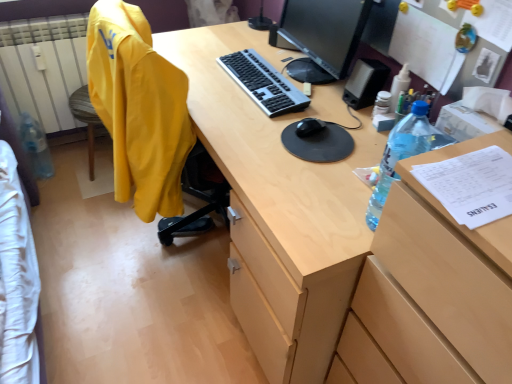
In the scene shown: Measure the distance between point (x=301, y=25) and camera.

The depth of point (x=301, y=25) is 1.62 meters.

Locate an element on the screen. black glossy monitor at upper center is located at coordinates (325, 30).

Identify the location of black matte mouse at center. (309, 127).

What do you see at coordinates (431, 291) in the screenshot? This screenshot has width=512, height=384. I see `wooden file cabinet at right` at bounding box center [431, 291].

The image size is (512, 384). What do you see at coordinates (139, 108) in the screenshot?
I see `yellow fabric jacket at left, the 1th clothing from the right` at bounding box center [139, 108].

This screenshot has height=384, width=512. I want to click on silver/black plastic keyboard at center, so click(263, 83).

Is yellow fabric computer chair at left to the left or to the right of black glossy monitor at upper center in the image?

In the image, yellow fabric computer chair at left appears on the left side of black glossy monitor at upper center.

Identify the location of computer chair below the black glossy monitor at upper center (from a real-world perspective). The height and width of the screenshot is (384, 512). (85, 120).

Does yellow fabric computer chair at left have a lesser height compared to black glossy monitor at upper center?

No.

Considering the relative sizes of yellow fabric computer chair at left and black glossy monitor at upper center in the image provided, is yellow fabric computer chair at left wider than black glossy monitor at upper center?

Correct, the width of yellow fabric computer chair at left exceeds that of black glossy monitor at upper center.

Is black plastic speaker at upper right oriented towards translucent plastic bottle at right, which appears as the first bottle when viewed from the front?

No.

Is there a large distance between black plastic speaker at upper right and translucent plastic bottle at right, which appears as the 2th bottle when viewed from the back?

No, there isn't a large distance between black plastic speaker at upper right and translucent plastic bottle at right, which appears as the 2th bottle when viewed from the back.

Is the depth of black plastic speaker at upper right less than that of translucent plastic bottle at right, placed as the first bottle when sorted from right to left?

No, the depth of black plastic speaker at upper right is greater than that of translucent plastic bottle at right, placed as the first bottle when sorted from right to left.

Can you tell me how much black plastic speaker at upper right and translucent plastic bottle at right, which appears as the first bottle when viewed from the front, differ in facing direction?

The facing directions of black plastic speaker at upper right and translucent plastic bottle at right, which appears as the first bottle when viewed from the front, are 0.652 degrees apart.

Between point (312, 226) and point (402, 237), which one is positioned in front?

The point (402, 237) is closer to the camera.

Which is behind, matte wood desk at center or wooden file cabinet at right?

matte wood desk at center is further from the camera.

Is matte wood desk at center smaller than wooden file cabinet at right?

Actually, matte wood desk at center might be larger than wooden file cabinet at right.

Is matte wood desk at center oriented towards wooden file cabinet at right?

No.

From a real-world perspective, which is physically above, translucent plastic bottle at right, which appears as the 2th bottle when viewed from the back, or clear plastic bottle at left, positioned as the second bottle in right-to-left order?

translucent plastic bottle at right, which appears as the 2th bottle when viewed from the back, from a real-world perspective.

From the image's perspective, is translucent plastic bottle at right, the 2th bottle from the left, positioned above or below clear plastic bottle at left, which is counted as the first bottle, starting from the back?

Based on their image positions, translucent plastic bottle at right, the 2th bottle from the left, is located beneath clear plastic bottle at left, which is counted as the first bottle, starting from the back.

Considering the relative sizes of translucent plastic bottle at right, placed as the first bottle when sorted from right to left, and clear plastic bottle at left, which ranks as the second bottle in front-to-back order, in the image provided, is translucent plastic bottle at right, placed as the first bottle when sorted from right to left, shorter than clear plastic bottle at left, which ranks as the second bottle in front-to-back order,?

Indeed, translucent plastic bottle at right, placed as the first bottle when sorted from right to left, has a lesser height compared to clear plastic bottle at left, which ranks as the second bottle in front-to-back order.

How many degrees apart are the facing directions of translucent plastic bottle at right, which appears as the first bottle when viewed from the front, and clear plastic bottle at left, which appears as the 1th bottle when viewed from the left?

translucent plastic bottle at right, which appears as the first bottle when viewed from the front, and clear plastic bottle at left, which appears as the 1th bottle when viewed from the left, are facing 89.8 degrees away from each other.

From the picture: Who is taller, wooden file cabinet at right or white cotton bedsheet at lower left, acting as the first clothing starting from the left?

wooden file cabinet at right.

Could you tell me if wooden file cabinet at right is facing white cotton bedsheet at lower left, acting as the first clothing starting from the left?

No, wooden file cabinet at right is not facing towards white cotton bedsheet at lower left, acting as the first clothing starting from the left.

Between wooden file cabinet at right and yellow fabric jacket at left, the 1th clothing from the right, which one has larger width?

Wider between the two is wooden file cabinet at right.

Is wooden file cabinet at right positioned far away from yellow fabric jacket at left, the 2th clothing viewed from the left?

That's not correct — wooden file cabinet at right is a little close to yellow fabric jacket at left, the 2th clothing viewed from the left.

Is wooden file cabinet at right bigger than yellow fabric jacket at left, the 1th clothing from the right?

Yes.

Would you say wooden file cabinet at right is outside yellow fabric jacket at left, the 2th clothing viewed from the left?

That's correct, wooden file cabinet at right is outside of yellow fabric jacket at left, the 2th clothing viewed from the left.

From a real-world perspective, is black matte mouse at center physically located above or below yellow fabric computer chair at left?

From a real-world perspective, black matte mouse at center is physically above yellow fabric computer chair at left.

Between black matte mouse at center and yellow fabric computer chair at left, which one has larger width?

With larger width is yellow fabric computer chair at left.

From the image's perspective, is black matte mouse at center over yellow fabric computer chair at left?

No, from the image's perspective, black matte mouse at center is not above yellow fabric computer chair at left.

Consider the image. Does black matte mouse at center appear on the right side of yellow fabric computer chair at left?

Yes, black matte mouse at center is to the right of yellow fabric computer chair at left.

The width and height of the screenshot is (512, 384). In order to click on television on the right of the yellow fabric computer chair at left in this screenshot , I will do `click(325, 30)`.

Find the location of a particular element. This screenshot has height=384, width=512. bottle in front of the black plastic speaker at upper right is located at coordinates (400, 154).

Looking at the image, which one is located closer to yellow fabric jacket at left, the 2th clothing viewed from the left, yellow fabric jacket at left or white cotton bedsheet at lower left, the second clothing viewed from the right?

white cotton bedsheet at lower left, the second clothing viewed from the right, is closer to yellow fabric jacket at left, the 2th clothing viewed from the left.

Estimate the real-world distances between objects in this image. Which object is further from yellow fabric computer chair at left, white cotton bedsheet at lower left, acting as the first clothing starting from the left, or wooden file cabinet at right?

Among the two, wooden file cabinet at right is located further to yellow fabric computer chair at left.

Which object lies further to the anchor point silver/black plastic keyboard at center, black matte mouse at center or black glossy monitor at upper center?

Among the two, black glossy monitor at upper center is located further to silver/black plastic keyboard at center.

Looking at the image, which one is located further to black glossy monitor at upper center, white cotton bedsheet at lower left, acting as the first clothing starting from the left, or matte wood desk at center?

white cotton bedsheet at lower left, acting as the first clothing starting from the left, lies further to black glossy monitor at upper center than the other object.

Which object lies further to the anchor point yellow fabric computer chair at left, clear plastic bottle at left, which is counted as the first bottle, starting from the back, or black glossy monitor at upper center?

black glossy monitor at upper center is positioned further to the anchor yellow fabric computer chair at left.

In the scene shown: Looking at the image, which one is located closer to yellow fabric computer chair at left, black matte mouse at center or yellow fabric jacket at left, the 1th clothing from the right?

yellow fabric jacket at left, the 1th clothing from the right.

Based on their spatial positions, is white cotton bedsheet at lower left, the second clothing viewed from the right, or matte wood desk at center closer to black plastic speaker at upper right?

matte wood desk at center.

Considering their positions, is silver/black plastic keyboard at center positioned further to black matte mouse at center than black glossy monitor at upper center?

black glossy monitor at upper center.

Locate an element on the screen. The image size is (512, 384). computer keyboard situated between yellow fabric jacket at left and matte wood desk at center from left to right is located at coordinates (263, 83).

This screenshot has height=384, width=512. Identify the location of computer keyboard between clear plastic bottle at left, which appears as the 1th bottle when viewed from the left, and black matte mouse at center. (263, 83).

Locate an element on the screen. This screenshot has height=384, width=512. desk situated between yellow fabric computer chair at left and black glossy monitor at upper center from left to right is located at coordinates [283, 176].

You are a GUI agent. You are given a task and a screenshot of the screen. Output one action in this format:
    pyautogui.click(x=<x>, y=<y>)
    Task: Click on the mouse between yellow fabric computer chair at left and black glossy monitor at upper center in the horizontal direction
    The image size is (512, 384).
    Given the screenshot: What is the action you would take?
    pyautogui.click(x=309, y=127)